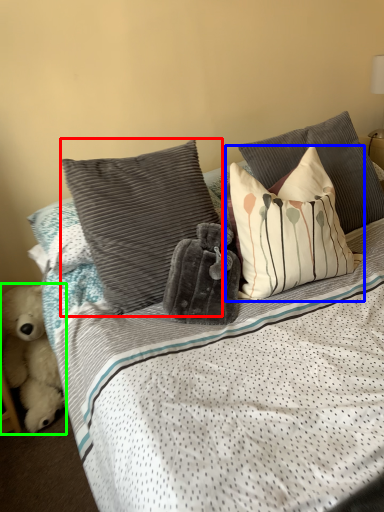
Question: Estimate the real-world distances between objects in this image. Which object is farther from pillow (highlighted by a red box), pillow (highlighted by a blue box) or teddy bear (highlighted by a green box)?

Choices:
 (A) pillow
 (B) teddy bear

Answer: (B)